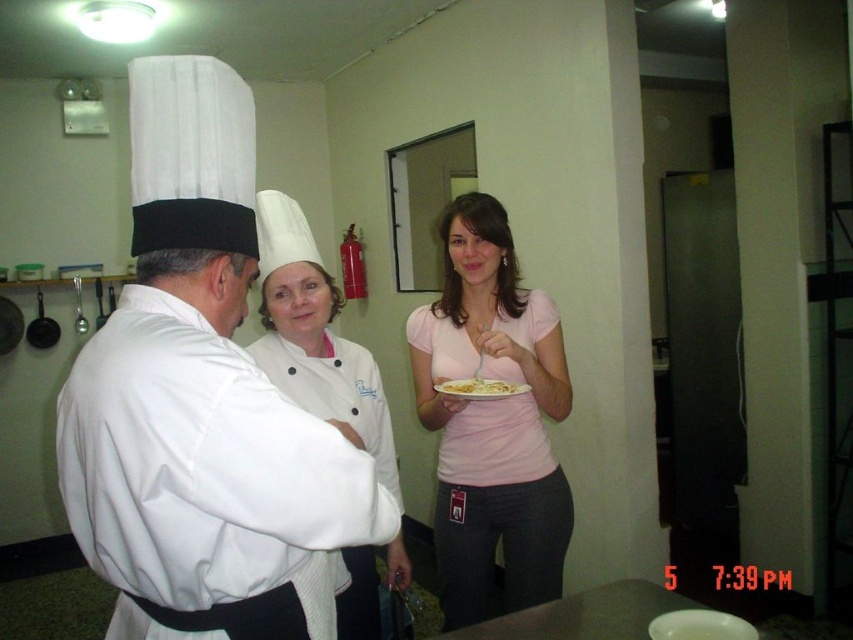
You are a new chef entering the kitchen and need to locate the pink matte shirt at center and the white matte chef hat at center. Which one appears taller when viewed from your position at the entrance?

The pink matte shirt at center appears taller than the white matte chef hat at center because the pink matte shirt at center has a greater height compared to white matte chef hat at center.

You are a delivery person who just arrived at the kitchen. You need to hand over a package to the person wearing the pink matte shirt at center. Based on the coordinates provided, where should you look to find them?

The person wearing the pink matte shirt at center is located at coordinates point (491, 419). So you should look towards that coordinate point to find them.